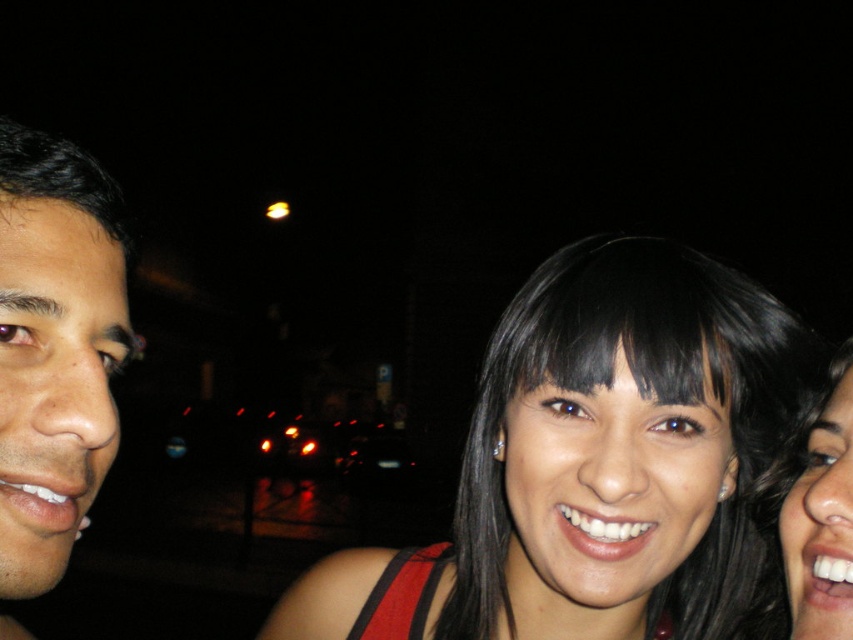
Does smooth skin face at left have a greater height compared to black glossy hair at right?

Yes, smooth skin face at left is taller than black glossy hair at right.

Is smooth skin face at left below black glossy hair at right?

Incorrect, smooth skin face at left is not positioned below black glossy hair at right.

Between point (30, 397) and point (817, 492), which one is positioned in front?

Point (30, 397) is more forward.

This screenshot has width=853, height=640. I want to click on smooth skin face at left, so click(54, 349).